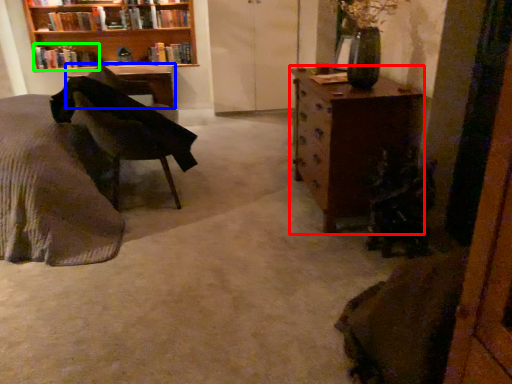
Question: Which object is positioned closest to chest of drawers (highlighted by a red box)? Select from desk (highlighted by a blue box) and book (highlighted by a green box).

Choices:
 (A) desk
 (B) book

Answer: (A)